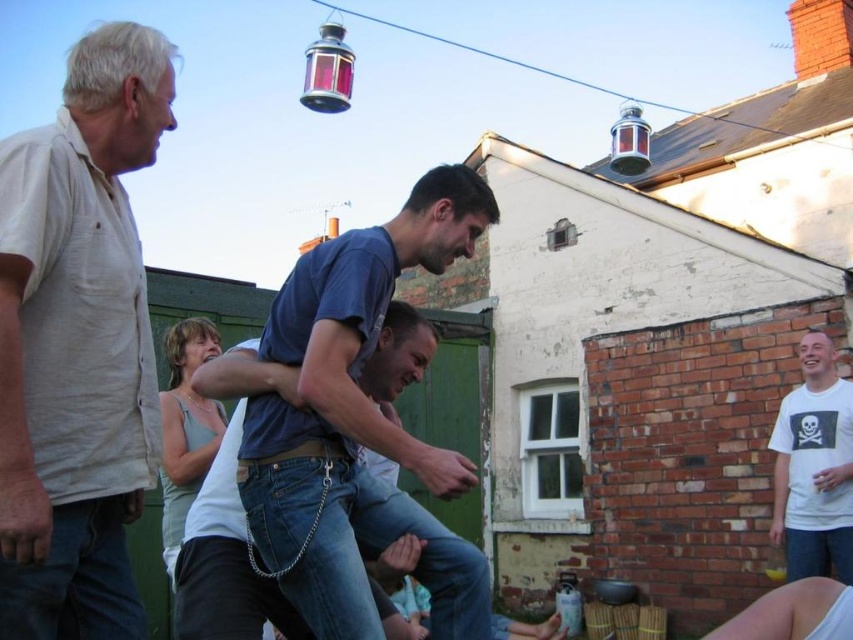
Does jeans at center have a lesser width compared to white matte t-shirt at right?

In fact, jeans at center might be wider than white matte t-shirt at right.

Describe the element at coordinates (355, 547) in the screenshot. The width and height of the screenshot is (853, 640). I see `jeans at center` at that location.

Who is more distant from viewer, (352, 524) or (813, 554)?

The point (813, 554) is behind.

The height and width of the screenshot is (640, 853). Identify the location of jeans at center. (355, 547).

Is jeans at left further to the viewer compared to denim jeans at lower right?

No, jeans at left is closer to the viewer.

Is point (126, 563) closer to viewer compared to point (821, 557)?

That is True.

Image resolution: width=853 pixels, height=640 pixels. I want to click on jeans at left, so click(74, 579).

From the picture: Which of these two, blue denim jeans at center or jeans at left, stands taller?

blue denim jeans at center

Does blue denim jeans at center come behind jeans at left?

Yes, it is behind jeans at left.

Who is more forward, (454, 202) or (51, 544)?

Positioned in front is point (51, 544).

Find the location of a particular element. This screenshot has height=640, width=853. blue denim jeans at center is located at coordinates (358, 424).